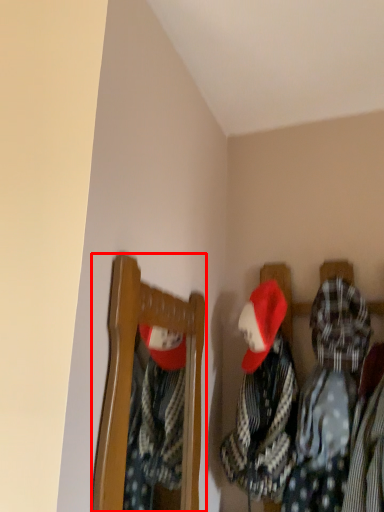
Question: From the image's perspective, where is furniture (annotated by the red box) located relative to clothing?

Choices:
 (A) below
 (B) above

Answer: (B)